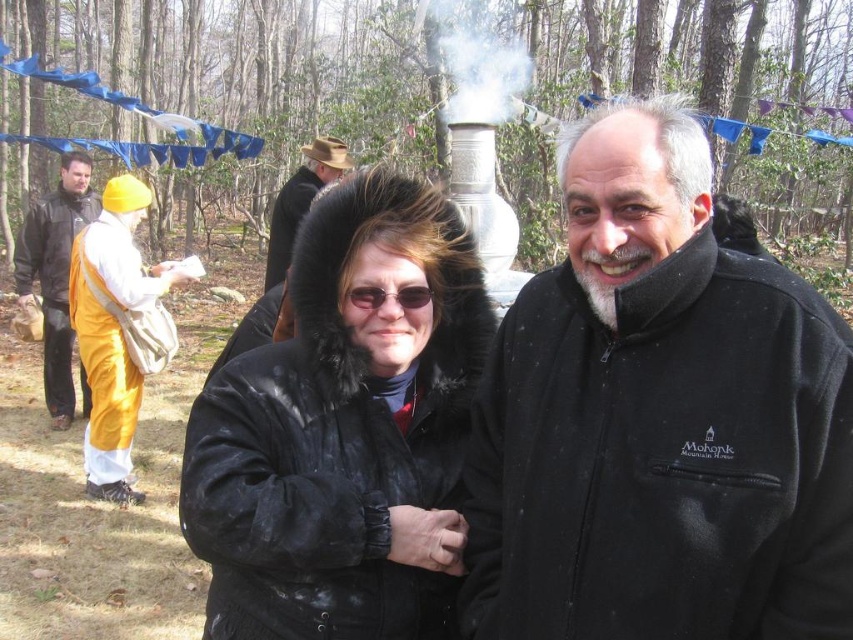
Does black fleece jacket at center lie behind matte yellow robe at left?

No, black fleece jacket at center is in front of matte yellow robe at left.

Looking at this image, is black fleece jacket at center to the left of matte yellow robe at left from the viewer's perspective?

No, black fleece jacket at center is not to the left of matte yellow robe at left.

This screenshot has width=853, height=640. Describe the element at coordinates (659, 420) in the screenshot. I see `black fleece jacket at center` at that location.

You are a GUI agent. You are given a task and a screenshot of the screen. Output one action in this format:
    pyautogui.click(x=<x>, y=<y>)
    Task: Click on the black fleece jacket at center
    The image size is (853, 640).
    Given the screenshot: What is the action you would take?
    [659, 420]

Which is more to the left, black fleece jacket at center or brown felt hat at upper center?

Positioned to the left is brown felt hat at upper center.

What do you see at coordinates (659, 420) in the screenshot? This screenshot has width=853, height=640. I see `black fleece jacket at center` at bounding box center [659, 420].

Is point (537, 528) less distant than point (280, 248)?

Yes, point (537, 528) is closer to viewer.

Find the location of `black fleece jacket at center`. black fleece jacket at center is located at coordinates (659, 420).

Is black fleece jacket at center above black leather jacket at center?

Yes.

Is point (769, 560) positioned in front of point (341, 204)?

Yes, it is.

Find the location of `black fleece jacket at center`. black fleece jacket at center is located at coordinates (659, 420).